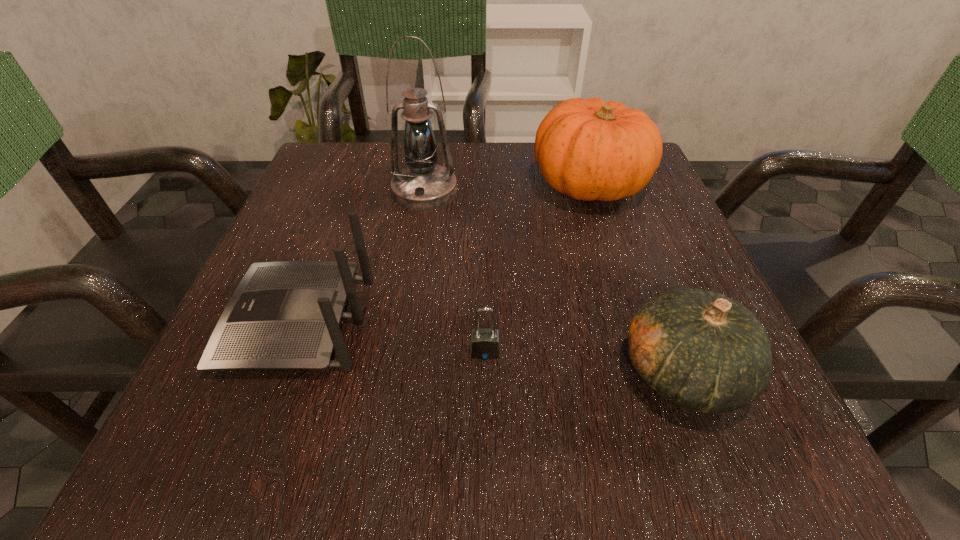
You are a GUI agent. You are given a task and a screenshot of the screen. Output one action in this format:
    pyautogui.click(x=<x>, y=<y>)
    Task: Click on the free space between the pumpkin and the gourd
    The image size is (960, 540).
    Given the screenshot: What is the action you would take?
    pyautogui.click(x=636, y=278)

Locate an element on the screen. The image size is (960, 540). free point between the padlock and the tallest object is located at coordinates (455, 272).

Identify the location of vacant space that is in between the pumpkin and the gourd. (636, 278).

Where is `free point between the gourd and the tallest object`? The width and height of the screenshot is (960, 540). free point between the gourd and the tallest object is located at coordinates (554, 282).

Identify the location of object that ranks as the closest to the router. (484, 344).

Identify the location of the second closest object to the gourd. The height and width of the screenshot is (540, 960). [589, 149].

Image resolution: width=960 pixels, height=540 pixels. I want to click on free region that satisfies the following two spatial constraints: 1. on the front-facing side of the gourd; 2. on the right side of the router, so click(279, 373).

This screenshot has height=540, width=960. Identify the location of vacant space that satisfies the following two spatial constraints: 1. on the shackle of the shortest object; 2. on the right side of the gourd. (485, 373).

Where is `free location that satisfies the following two spatial constraints: 1. on the shackle of the third object from left to right; 2. on the left side of the gourd`? free location that satisfies the following two spatial constraints: 1. on the shackle of the third object from left to right; 2. on the left side of the gourd is located at coordinates (485, 373).

Identify the location of free space that satisfies the following two spatial constraints: 1. on the front side of the gourd; 2. on the left side of the pumpkin. This screenshot has height=540, width=960. click(x=650, y=373).